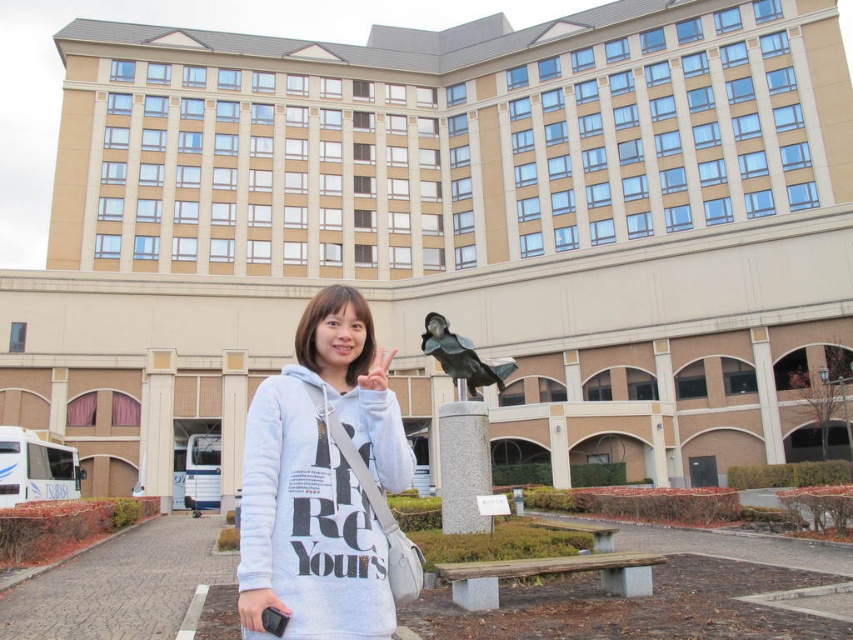
The height and width of the screenshot is (640, 853). What do you see at coordinates (320, 483) in the screenshot?
I see `white cotton hoodie at center` at bounding box center [320, 483].

Does point (323, 362) come closer to viewer compared to point (463, 349)?

That is True.

Image resolution: width=853 pixels, height=640 pixels. I want to click on white cotton hoodie at center, so click(320, 483).